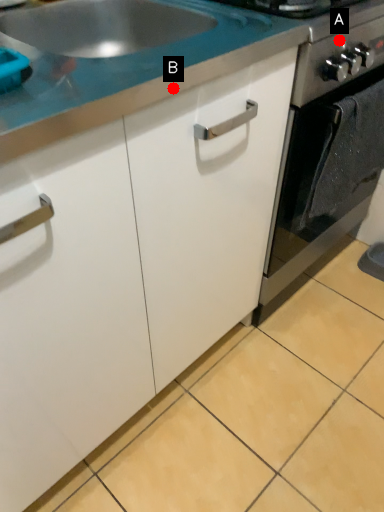
Question: Two points are circled on the image, labeled by A and B beside each circle. Which point is further to the camera?

Choices:
 (A) A is further
 (B) B is further

Answer: (A)